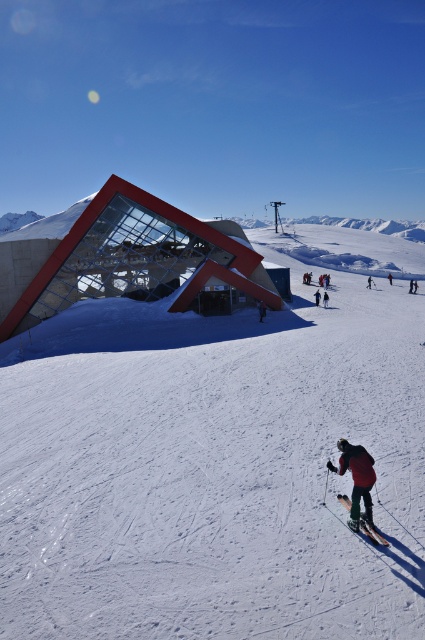
Is white smooth snow at center further to camera compared to shiny metallic skis at lower center?

That is False.

Is white smooth snow at center to the left of shiny metallic skis at lower center from the viewer's perspective?

No, white smooth snow at center is not to the left of shiny metallic skis at lower center.

At what (x,y) coordinates should I click in order to perform the action: click on white smooth snow at center. Please return your answer as a coordinate pair (x, y). The width and height of the screenshot is (425, 640). Looking at the image, I should click on (218, 460).

Does dark blue ski pants at center appear under black matte snowboarder at lower right?

Correct, dark blue ski pants at center is located below black matte snowboarder at lower right.

Is point (260, 307) closer to camera compared to point (371, 282)?

That is True.

Locate an element on the screen. The width and height of the screenshot is (425, 640). dark blue ski pants at center is located at coordinates (260, 308).

At what (x,y) coordinates should I click in order to perform the action: click on dark blue ski jacket at center. Please return your answer as a coordinate pair (x, y). Looking at the image, I should click on (317, 296).

In the scene shown: Which is more to the right, dark blue ski jacket at center or red ski suit at center?

Positioned to the right is red ski suit at center.

Between point (317, 289) and point (390, 280), which one is positioned behind?

Positioned behind is point (390, 280).

Image resolution: width=425 pixels, height=640 pixels. Find the location of `dark blue ski jacket at center`. dark blue ski jacket at center is located at coordinates (317, 296).